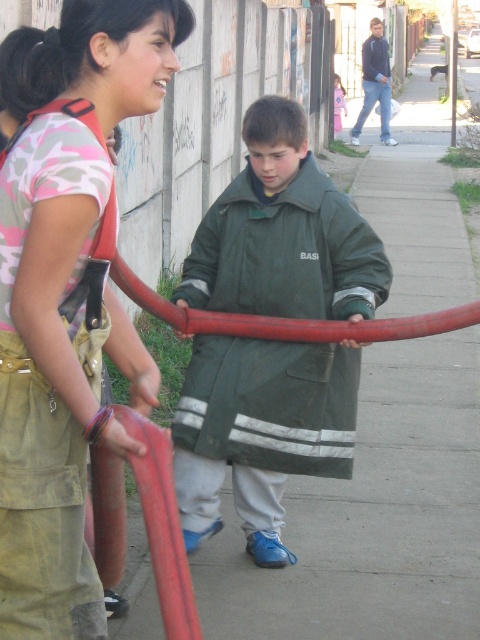
You are a photographer setting up a shoot on the sidewalk. You have two subjects wearing the camouflage fabric shirt at center and the green matte jacket at center. To ensure both are visible in the frame, which subject should you position closer to the camera?

The camouflage fabric shirt at center is shorter in height compared to the green matte jacket at center. To ensure both are visible, position the camouflage fabric shirt at center closer to the camera so its smaller stature can be seen alongside the taller individual.